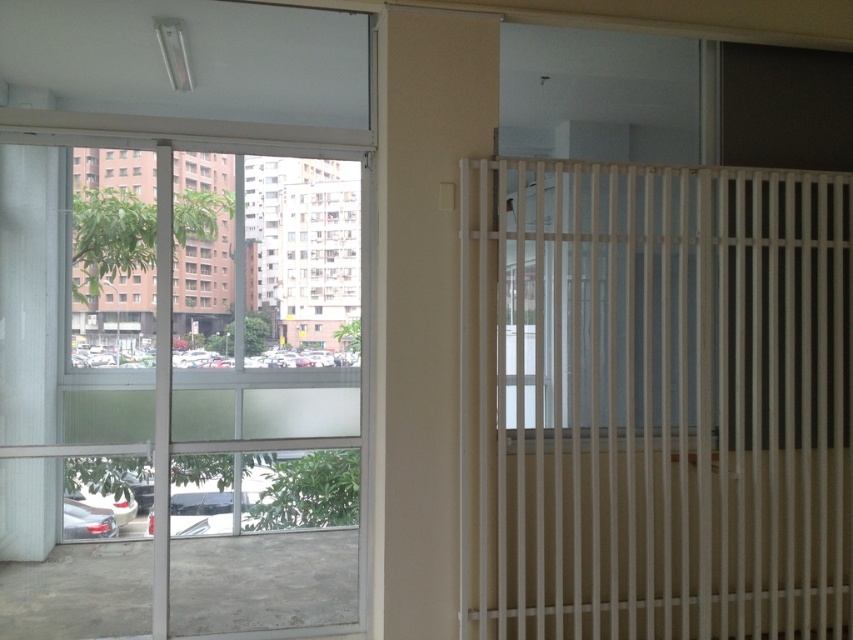
Is point (763, 172) positioned behind point (54, 616)?

No, (763, 172) is in front of (54, 616).

Does point (724, 397) come closer to viewer compared to point (82, 374)?

Yes, point (724, 397) is in front of point (82, 374).

The image size is (853, 640). What are the coordinates of `white wood radiator at upper right` in the screenshot? It's located at (656, 401).

This screenshot has height=640, width=853. Identify the location of white wood radiator at upper right. (656, 401).